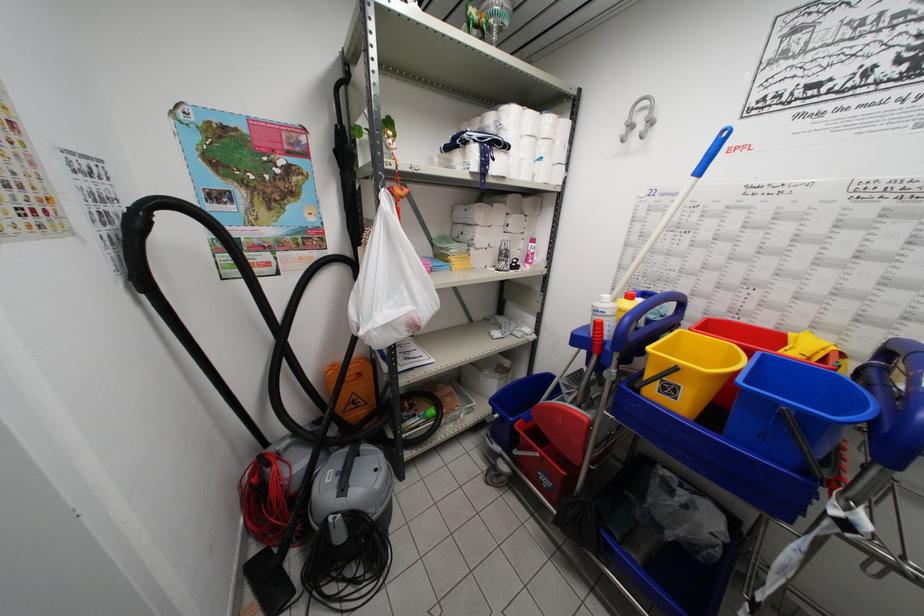
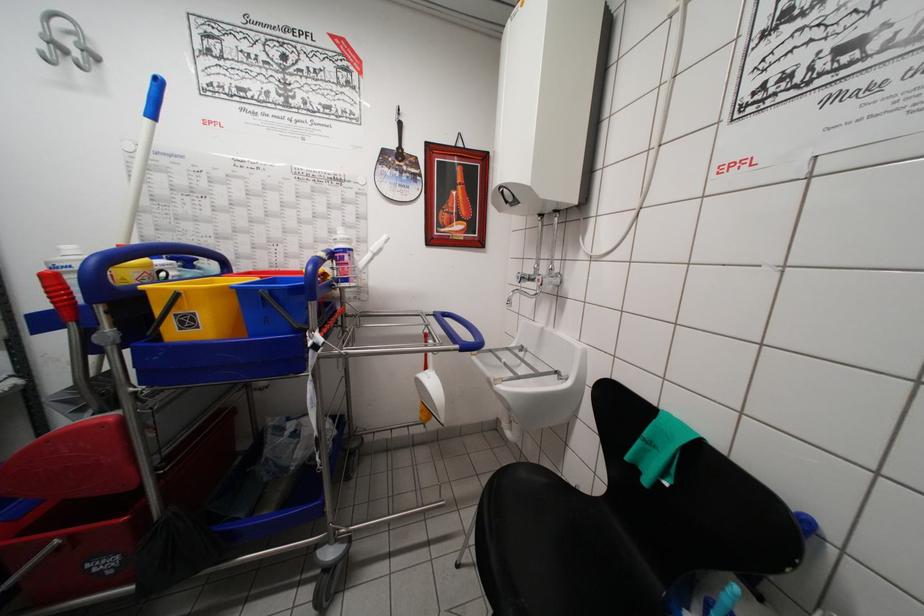
The point at (606, 334) is marked in the first image. Where is the corresponding point in the second image?

(67, 289)